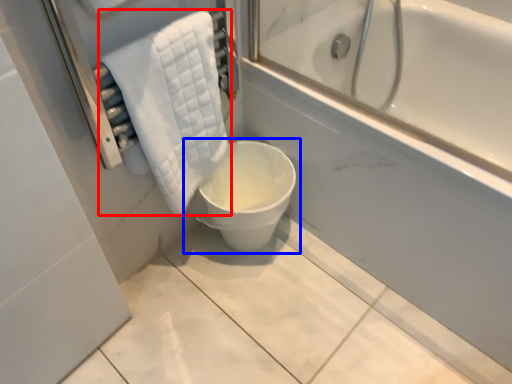
Question: Among these objects, which one is farthest to the camera, towel (highlighted by a red box) or toilet (highlighted by a blue box)?

Choices:
 (A) towel
 (B) toilet

Answer: (B)